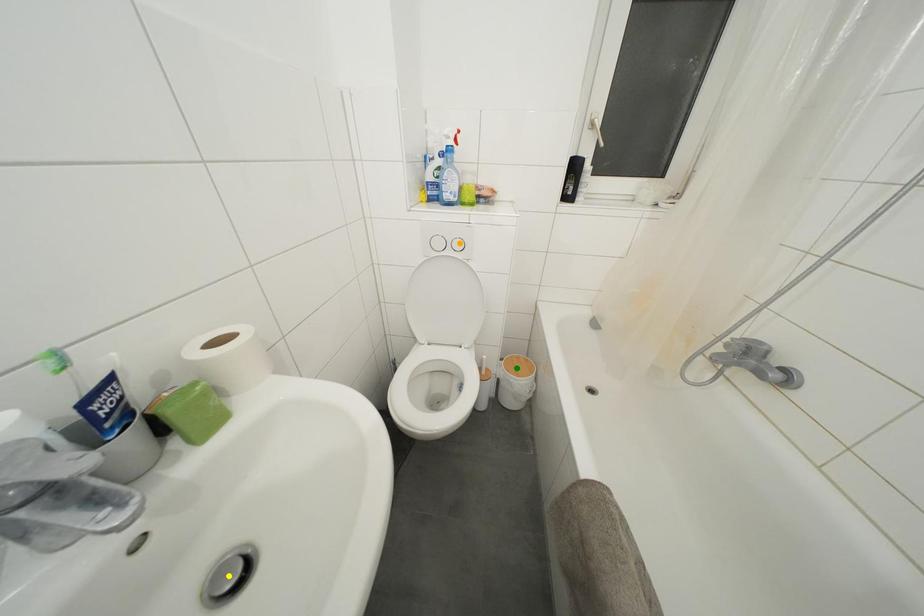
Order these from nearest to farthest:
orange point
yellow point
green point

1. yellow point
2. orange point
3. green point